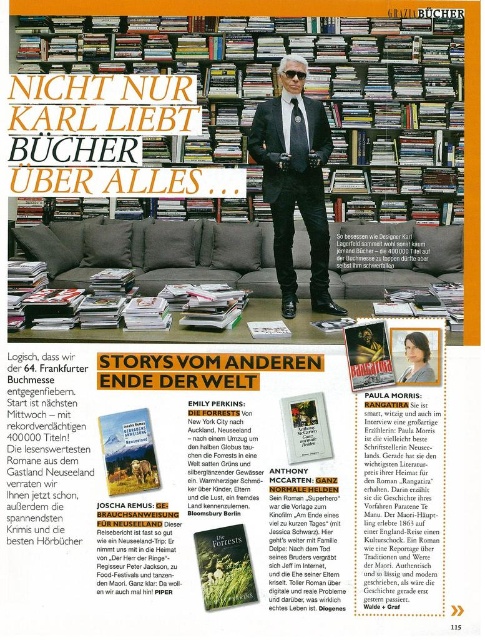
Question: Which point is closer to the camera?

Choices:
 (A) white glossy magazines at lower left
 (B) matte black book at center
 (C) black velvet suit at center

Answer: (B)

Question: Is wooden bookshelf at upper center smaller than black plastic goggles at upper center?

Choices:
 (A) no
 (B) yes

Answer: (A)

Question: Which point is farther from the camera taking this photo?

Choices:
 (A) pos(372,378)
 (B) pos(44,300)

Answer: (B)

Question: Does black velvet suit at center have a greater width compared to matte green paper at center?

Choices:
 (A) yes
 (B) no

Answer: (A)

Question: Which object is the farthest from the wooden bookshelf at upper center?

Choices:
 (A) white glossy magazines at lower left
 (B) matte paper magazine at center
 (C) black velvet suit at center
 (D) matte green paper at center

Answer: (D)

Question: Observing the image, what is the correct spatial positioning of matte paper magazine at center in reference to matte white paper at center?

Choices:
 (A) below
 (B) above

Answer: (A)